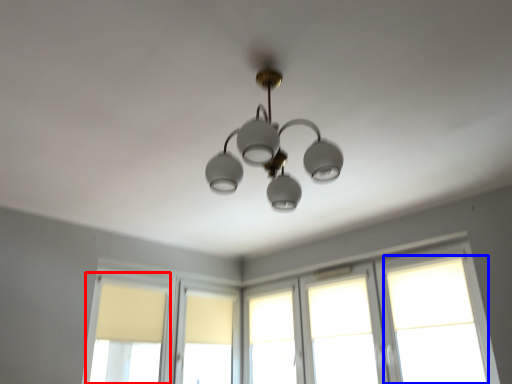
Question: Which of the following is the farthest to the observer, window (highlighted by a red box) or window (highlighted by a blue box)?

Choices:
 (A) window
 (B) window

Answer: (A)